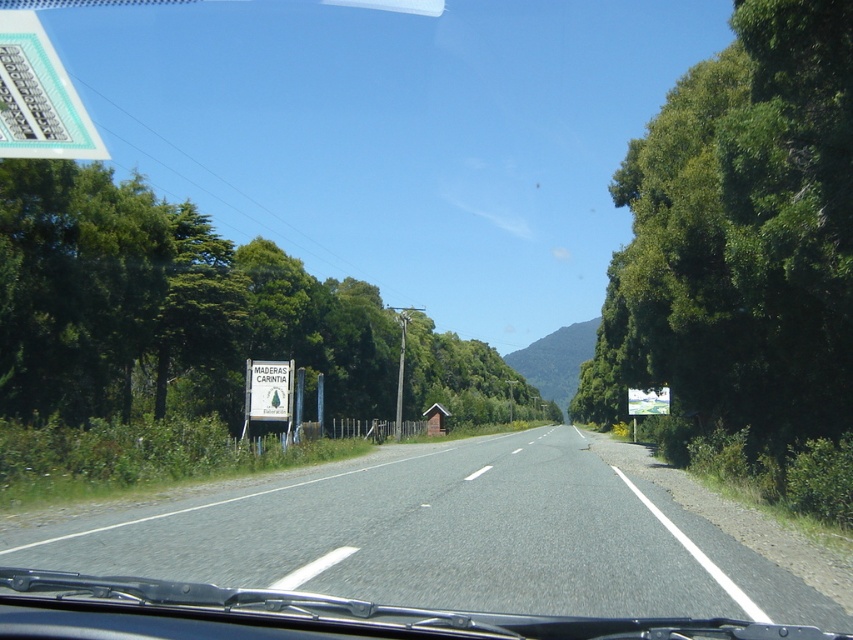
Question: Which is nearer to the green leafy tree at left?

Choices:
 (A) green leafy tree at right
 (B) white plastic sign at center
 (C) green plastic sign at upper left

Answer: (A)

Question: Can you confirm if green leafy tree at right is bigger than green leafy tree at left?

Choices:
 (A) no
 (B) yes

Answer: (A)

Question: Where is gray asphalt road at center located in relation to green leafy tree at left in the image?

Choices:
 (A) above
 (B) below

Answer: (B)

Question: Estimate the real-world distances between objects in this image. Which object is farther from the green leafy tree at right?

Choices:
 (A) green leafy tree at left
 (B) green plastic sign at upper left
 (C) white plastic sign at center

Answer: (C)

Question: Considering the relative positions of gray asphalt road at center and green plastic sign at upper left in the image provided, where is gray asphalt road at center located with respect to green plastic sign at upper left?

Choices:
 (A) above
 (B) below

Answer: (B)

Question: Which point is closer to the camera?

Choices:
 (A) green leafy tree at right
 (B) white plastic sign at center

Answer: (A)